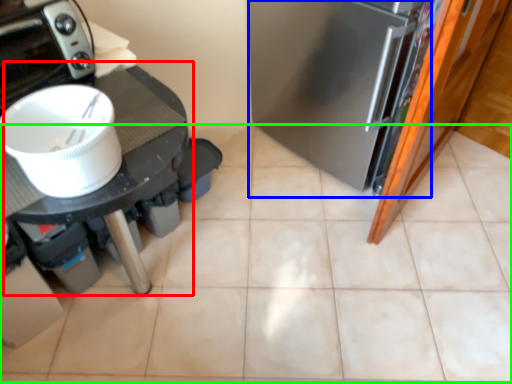
Question: Which is nearer to the table (highlighted by a red box)? fridge (highlighted by a blue box) or ceramic tile (highlighted by a green box).

Choices:
 (A) fridge
 (B) ceramic tile

Answer: (A)